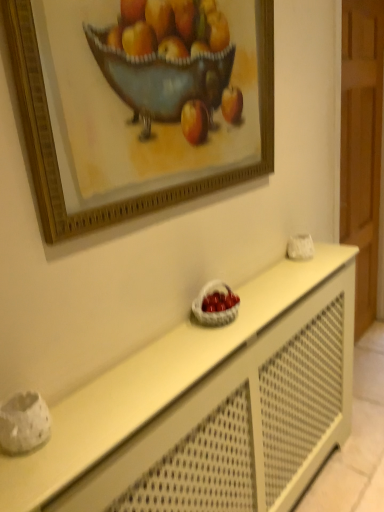
Question: Is white woven basket at center directly adjacent to gold wooden picture frame at upper center?

Choices:
 (A) no
 (B) yes

Answer: (A)

Question: From a real-world perspective, is white woven basket at center on gold wooden picture frame at upper center?

Choices:
 (A) yes
 (B) no

Answer: (B)

Question: Is white woven basket at center facing away from gold wooden picture frame at upper center?

Choices:
 (A) no
 (B) yes

Answer: (A)

Question: Does white woven basket at center have a lesser width compared to gold wooden picture frame at upper center?

Choices:
 (A) no
 (B) yes

Answer: (A)

Question: Is white woven basket at center taller than gold wooden picture frame at upper center?

Choices:
 (A) yes
 (B) no

Answer: (B)

Question: Can we say white woven basket at center lies outside gold wooden picture frame at upper center?

Choices:
 (A) yes
 (B) no

Answer: (A)

Question: Is white matte table at center not near white woven basket at center?

Choices:
 (A) yes
 (B) no

Answer: (B)

Question: Is white woven basket at center located within white matte table at center?

Choices:
 (A) no
 (B) yes

Answer: (A)

Question: Does white matte table at center have a lesser width compared to white woven basket at center?

Choices:
 (A) yes
 (B) no

Answer: (B)

Question: Is white matte table at center aimed at white woven basket at center?

Choices:
 (A) yes
 (B) no

Answer: (B)

Question: Does white matte table at center have a larger size compared to white woven basket at center?

Choices:
 (A) yes
 (B) no

Answer: (A)

Question: Can you confirm if white matte table at center is wider than white woven basket at center?

Choices:
 (A) yes
 (B) no

Answer: (A)

Question: Does gold wooden picture frame at upper center have a greater width compared to white matte table at center?

Choices:
 (A) no
 (B) yes

Answer: (A)